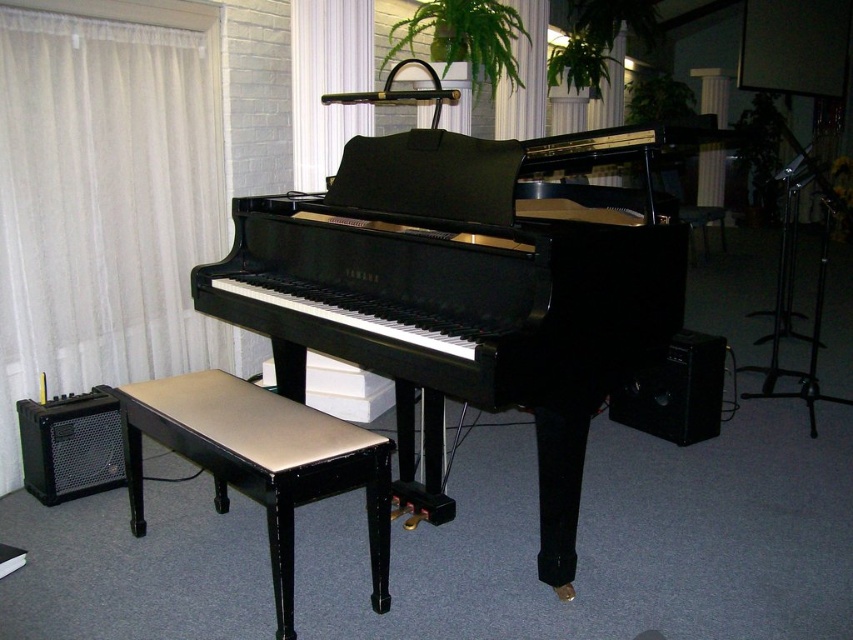
Can you confirm if black polished piano at center is taller than black matte speaker at lower right?

Yes.

Does black polished piano at center appear on the right side of black matte speaker at lower right?

In fact, black polished piano at center is to the left of black matte speaker at lower right.

Does point (457, 176) lie in front of point (693, 438)?

Yes, it is in front of point (693, 438).

At what (x,y) coordinates should I click in order to perform the action: click on black polished piano at center. Please return your answer as a coordinate pair (x, y). This screenshot has height=640, width=853. Looking at the image, I should click on (469, 289).

Is point (669, 305) closer to camera compared to point (79, 108)?

Yes, point (669, 305) is in front of point (79, 108).

Is black polished piano at center below white sheer curtain at left?

Yes, black polished piano at center is below white sheer curtain at left.

Measure the distance between point (422, 332) and camera.

Point (422, 332) and camera are 2.15 meters apart from each other.

Locate an element on the screen. Image resolution: width=853 pixels, height=640 pixels. black polished piano at center is located at coordinates (469, 289).

This screenshot has height=640, width=853. What do you see at coordinates (105, 200) in the screenshot?
I see `white sheer curtain at left` at bounding box center [105, 200].

The image size is (853, 640). Find the location of `white sheer curtain at left`. white sheer curtain at left is located at coordinates (105, 200).

Locate an element on the screen. white sheer curtain at left is located at coordinates (105, 200).